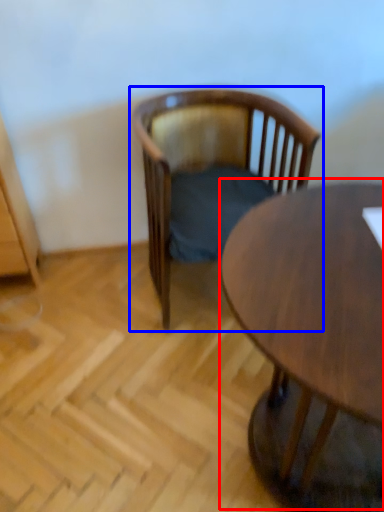
Question: Which object appears closest to the camera in this image, coffee table (highlighted by a red box) or chair (highlighted by a blue box)?

Choices:
 (A) coffee table
 (B) chair

Answer: (A)